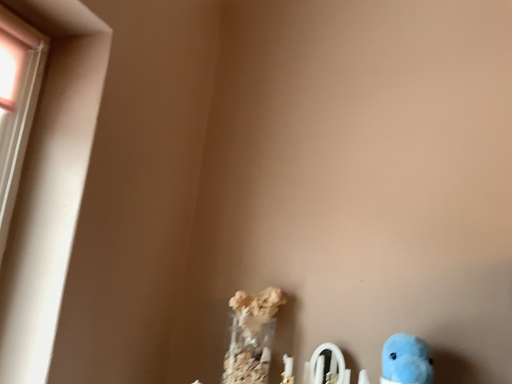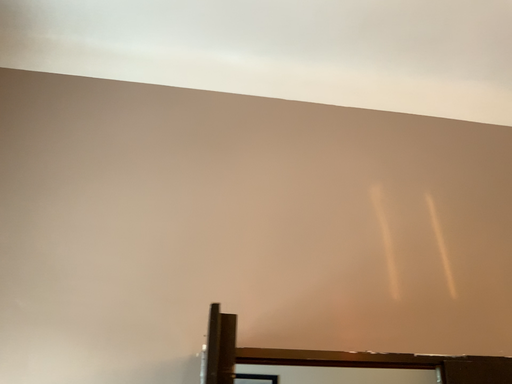
Question: Which way did the camera rotate in the video?

Choices:
 (A) rotated left
 (B) rotated right

Answer: (B)